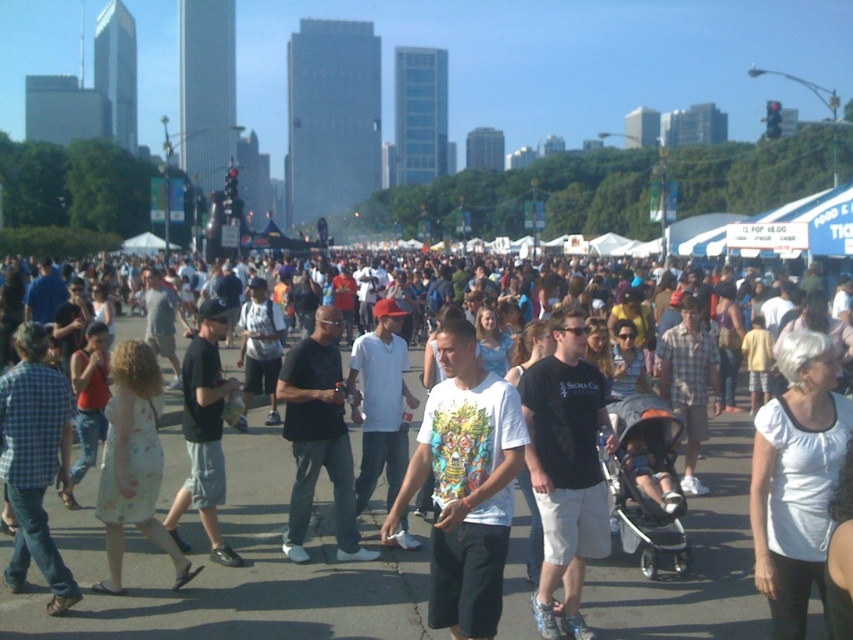
Does white cotton crowd at center appear over black matte shirt at center?

No.

Is white cotton crowd at center further to camera compared to black matte shirt at center?

No, it is in front of black matte shirt at center.

Who is more distant from viewer, (399, 566) or (334, 456)?

The point (334, 456) is behind.

This screenshot has width=853, height=640. In order to click on white cotton crowd at center in this screenshot , I will do `click(238, 568)`.

Can you confirm if white cotton crowd at center is taller than white matte t-shirt at center?

No.

Which is behind, point (437, 636) or point (434, 426)?

Positioned behind is point (437, 636).

What are the coordinates of `white cotton crowd at center` in the screenshot? It's located at (238, 568).

What do you see at coordinates (465, 484) in the screenshot? I see `white matte t-shirt at center` at bounding box center [465, 484].

Identify the location of white matte t-shirt at center. The image size is (853, 640). (465, 484).